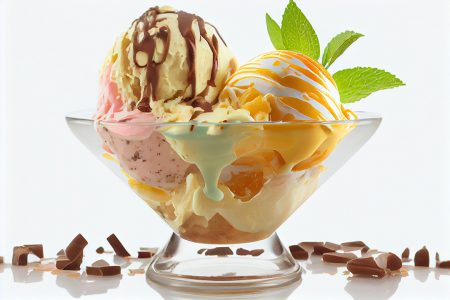
What are the coordinates of `bowl` in the screenshot? It's located at (324, 175).